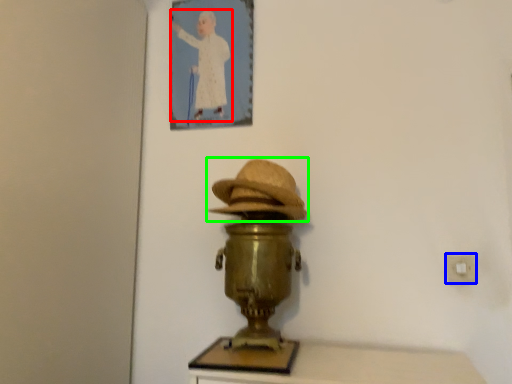
Question: Which object is positioned farthest from person (highlighted by a red box)? Select from electric outlet (highlighted by a blue box) and hat (highlighted by a green box).

Choices:
 (A) electric outlet
 (B) hat

Answer: (A)